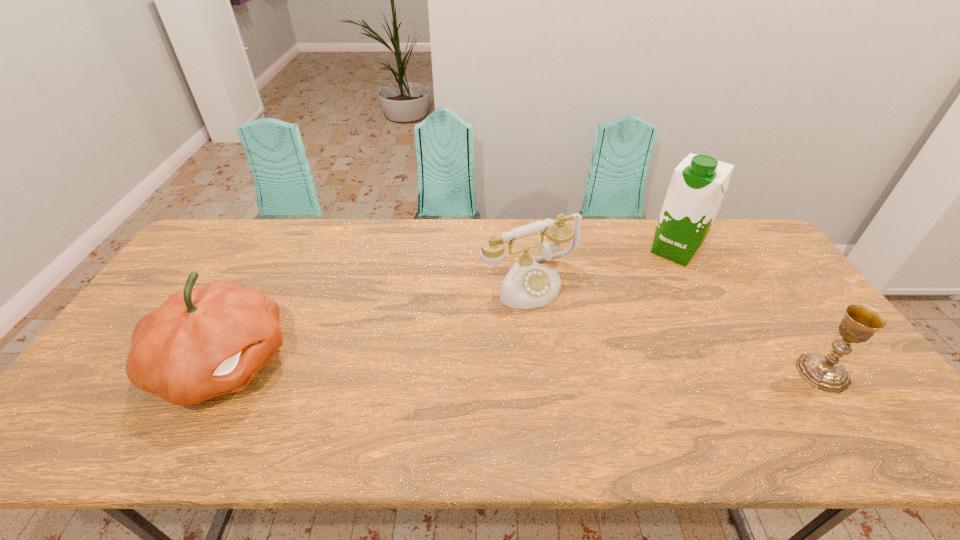
Identify the location of pumpkin. (202, 342).

Image resolution: width=960 pixels, height=540 pixels. Find the location of `the second tallest object`. the second tallest object is located at coordinates (202, 342).

Where is `the rightmost object`? the rightmost object is located at coordinates (860, 322).

Locate an element on the screen. The height and width of the screenshot is (540, 960). the third object from right to left is located at coordinates (528, 284).

Where is `the tallest object`? This screenshot has width=960, height=540. the tallest object is located at coordinates (698, 185).

The image size is (960, 540). Find the location of `soya milk`. soya milk is located at coordinates (698, 185).

The width and height of the screenshot is (960, 540). In order to click on vacant region located on the front face of the pumpkin in this screenshot , I will do `click(326, 363)`.

Locate an element on the screen. The height and width of the screenshot is (540, 960). vacant space positioned on the left of the rightmost object is located at coordinates (647, 373).

Where is `vacant area located 0.120m on the dial of the telephone`? This screenshot has height=540, width=960. vacant area located 0.120m on the dial of the telephone is located at coordinates (580, 335).

The height and width of the screenshot is (540, 960). Find the location of `free location located 0.070m on the dial of the telephone`. free location located 0.070m on the dial of the telephone is located at coordinates (569, 322).